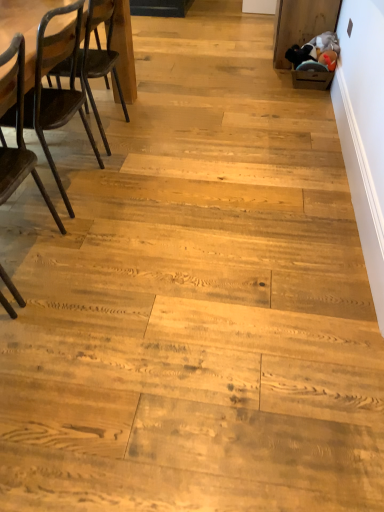
You are a GUI agent. You are given a task and a screenshot of the screen. Output one action in this format:
    pyautogui.click(x=<x>, y=<y>)
    Task: Click on the space that is in front of dark brown wood chair at left, positioned as the 2th chair in front-to-back order
    Image resolution: width=384 pixels, height=512 pixels.
    Given the screenshot: What is the action you would take?
    pyautogui.click(x=74, y=238)